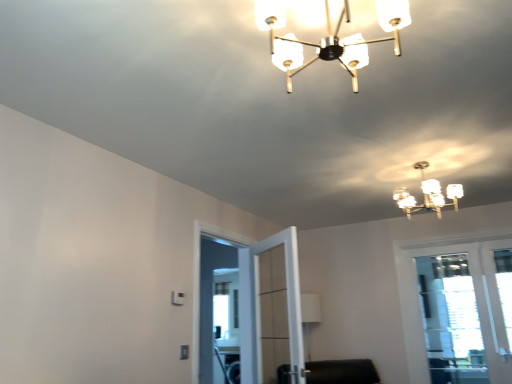
Question: From the image's perspective, does white frosted glass chandelier at upper center, which is the second lamp from left to right, appear higher than clear glass door at right?

Choices:
 (A) yes
 (B) no

Answer: (A)

Question: Considering the relative sizes of white frosted glass chandelier at upper center, which ranks as the 1th lamp in back-to-front order, and clear glass door at right in the image provided, is white frosted glass chandelier at upper center, which ranks as the 1th lamp in back-to-front order, bigger than clear glass door at right?

Choices:
 (A) no
 (B) yes

Answer: (A)

Question: From a real-world perspective, is white frosted glass chandelier at upper center, the 1th lamp positioned from the bottom, positioned over clear glass door at right based on gravity?

Choices:
 (A) no
 (B) yes

Answer: (B)

Question: Is white frosted glass chandelier at upper center, arranged as the 1th lamp when viewed from the right, shorter than clear glass door at right?

Choices:
 (A) yes
 (B) no

Answer: (A)

Question: From a real-world perspective, is white frosted glass chandelier at upper center, the 1th lamp positioned from the bottom, beneath clear glass door at right?

Choices:
 (A) no
 (B) yes

Answer: (A)

Question: Considering the positions of clear glass door at center and translucent glass chandelier at upper center, positioned as the 1th lamp in top-to-bottom order, in the image, is clear glass door at center taller or shorter than translucent glass chandelier at upper center, positioned as the 1th lamp in top-to-bottom order,?

Choices:
 (A) tall
 (B) short

Answer: (A)

Question: Is point (267, 311) closer or farther from the camera than point (263, 14)?

Choices:
 (A) closer
 (B) farther

Answer: (B)

Question: Visually, is clear glass door at center positioned to the left or to the right of translucent glass chandelier at upper center, which is the 2th lamp in back-to-front order?

Choices:
 (A) left
 (B) right

Answer: (A)

Question: Considering their positions, is clear glass door at center located in front of or behind translucent glass chandelier at upper center, arranged as the first lamp when viewed from the left?

Choices:
 (A) front
 (B) behind

Answer: (B)

Question: Does point (416, 162) appear closer or farther from the camera than point (337, 23)?

Choices:
 (A) closer
 (B) farther

Answer: (B)

Question: In terms of width, does white frosted glass chandelier at upper center, the second lamp in the front-to-back sequence, look wider or thinner when compared to translucent glass chandelier at upper center, arranged as the first lamp when viewed from the left?

Choices:
 (A) wide
 (B) thin

Answer: (B)

Question: From the image's perspective, is white frosted glass chandelier at upper center, which is the second lamp from left to right, above or below translucent glass chandelier at upper center, arranged as the first lamp when viewed from the left?

Choices:
 (A) below
 (B) above

Answer: (A)

Question: Based on their sizes in the image, would you say white frosted glass chandelier at upper center, the second lamp in the front-to-back sequence, is bigger or smaller than translucent glass chandelier at upper center, arranged as the first lamp when viewed from the left?

Choices:
 (A) small
 (B) big

Answer: (B)

Question: Relative to clear glass door at center, is translucent glass chandelier at upper center, which is the 2th lamp in back-to-front order, in front or behind?

Choices:
 (A) front
 (B) behind

Answer: (A)

Question: Looking at the image, does translucent glass chandelier at upper center, which is the 2th lamp in back-to-front order, seem bigger or smaller compared to clear glass door at center?

Choices:
 (A) big
 (B) small

Answer: (B)